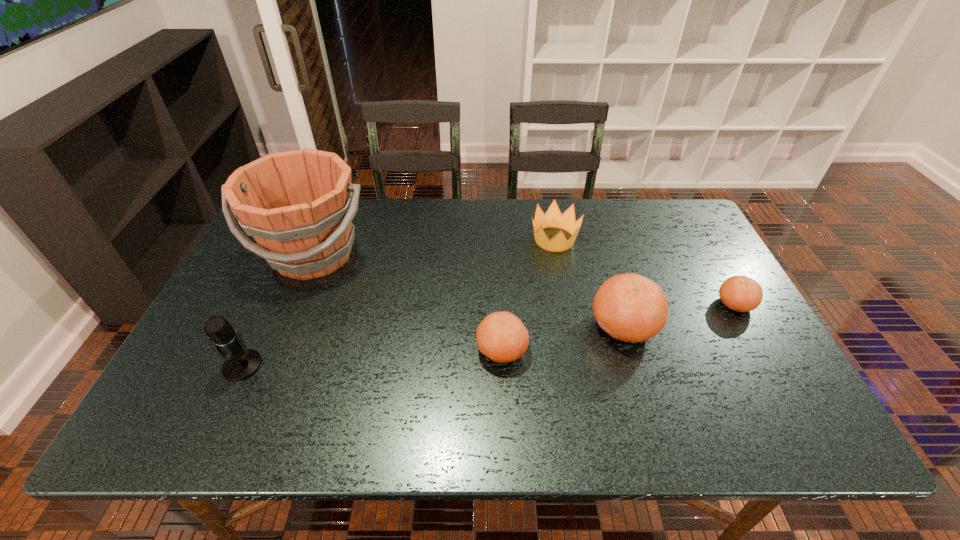
I want to click on vacant space that satisfies the following two spatial constraints: 1. on the back side of the second shortest clementine; 2. on the right side of the microphone, so click(250, 350).

At what (x,y) coordinates should I click in order to perform the action: click on free space that satisfies the following two spatial constraints: 1. on the handle side of the leftmost clementine; 2. on the right side of the bucket. Please return your answer as a coordinate pair (x, y). Looking at the image, I should click on tap(274, 350).

Where is `free space that satisfies the following two spatial constraints: 1. on the front side of the shortest clementine; 2. on the left side of the crown`? free space that satisfies the following two spatial constraints: 1. on the front side of the shortest clementine; 2. on the left side of the crown is located at coordinates (566, 304).

I want to click on free space that satisfies the following two spatial constraints: 1. on the handle side of the tallest clementine; 2. on the right side of the bucket, so click(x=284, y=326).